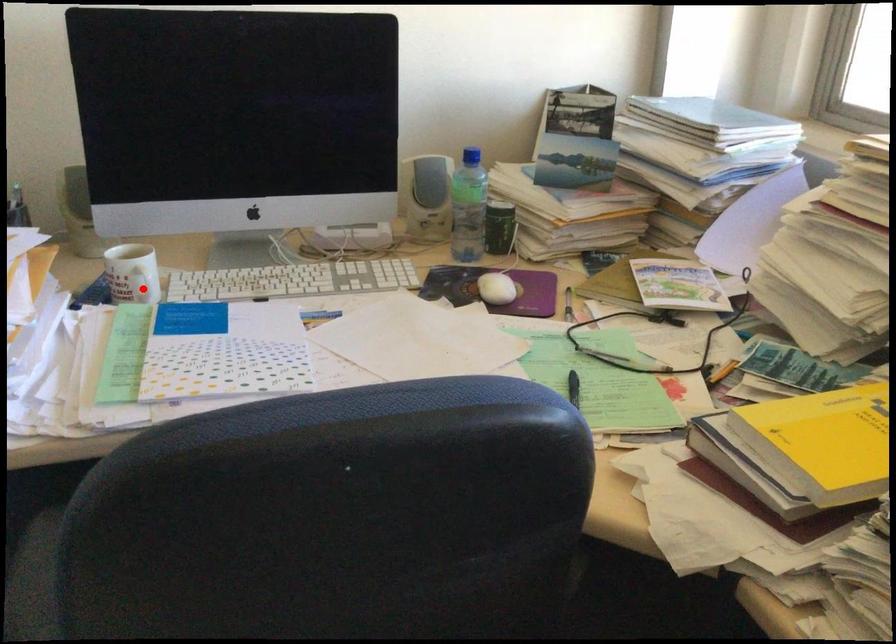
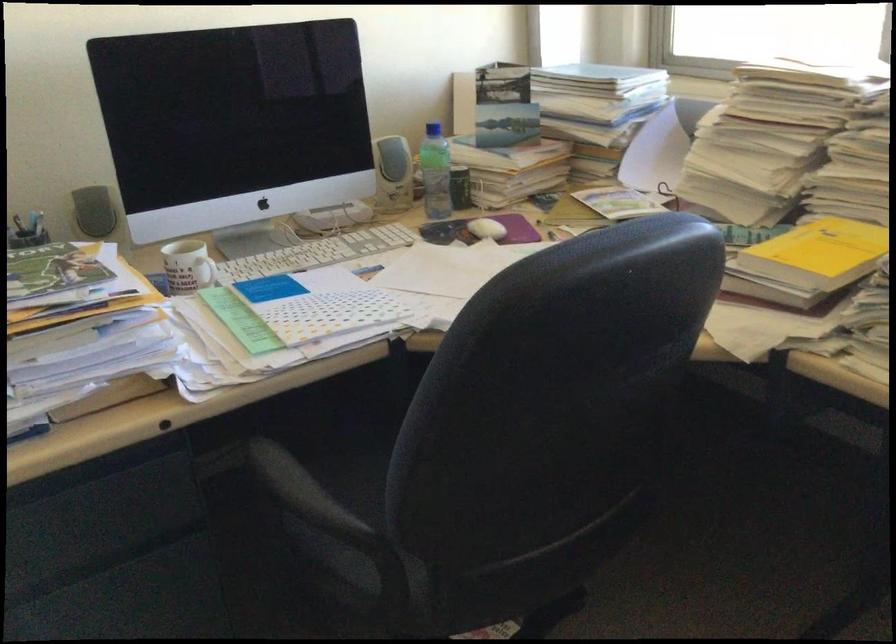
The point at the highlighted location is marked in the first image. Where is the corresponding point in the second image?

(204, 272)